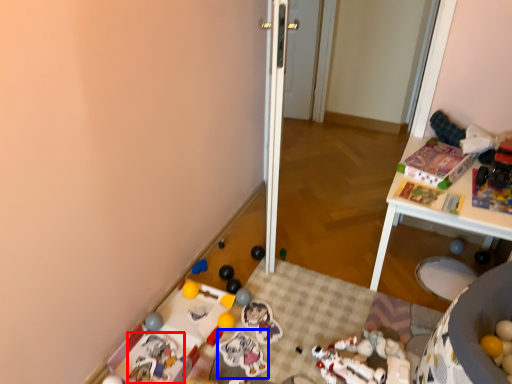
Question: Which object appears farthest to the camera in this image, toy (highlighted by a red box) or toy (highlighted by a blue box)?

Choices:
 (A) toy
 (B) toy

Answer: (B)